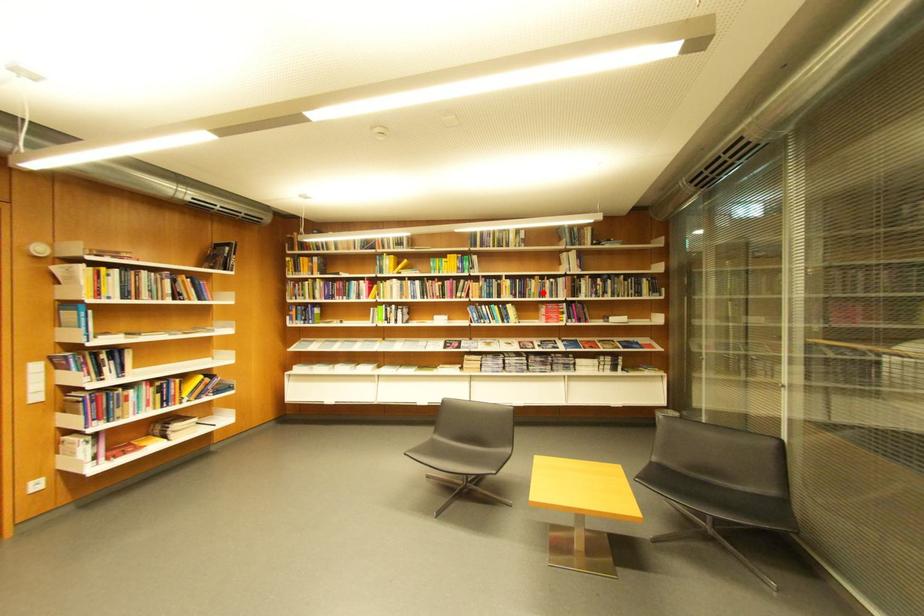
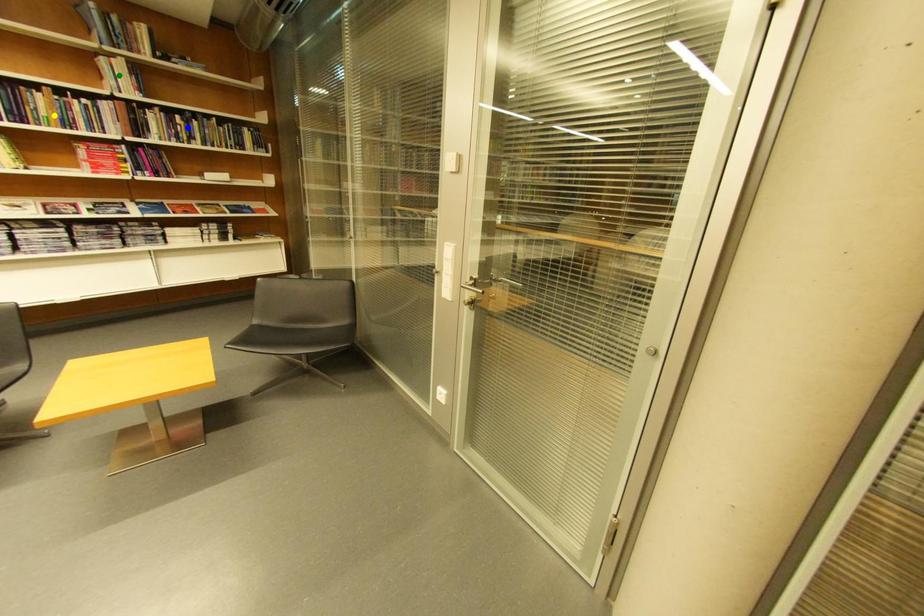
Question: I am providing you with two images of the same scene from different viewpoints. A red point is marked on the first image. You are given multiple points on the second image. Which spot in image 2 lines up with the point in image 1?

Choices:
 (A) green point
 (B) blue point
 (C) yellow point

Answer: (C)